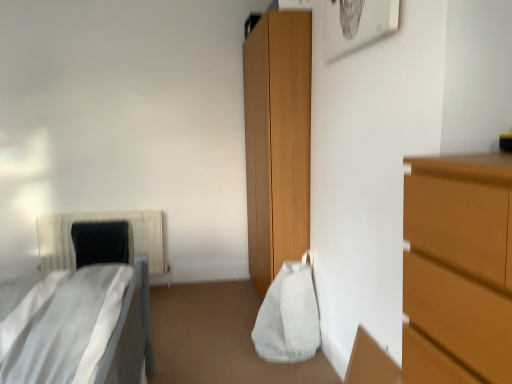
Question: Considering the relative positions of white fabric bag at center and white textured radiator at left in the image provided, is white fabric bag at center to the left of white textured radiator at left from the viewer's perspective?

Choices:
 (A) no
 (B) yes

Answer: (A)

Question: From the image's perspective, is white fabric bag at center above white textured radiator at left?

Choices:
 (A) yes
 (B) no

Answer: (B)

Question: Is white textured radiator at left surrounded by white fabric bag at center?

Choices:
 (A) no
 (B) yes

Answer: (A)

Question: Can you confirm if white fabric bag at center is smaller than white textured radiator at left?

Choices:
 (A) yes
 (B) no

Answer: (A)

Question: Can you confirm if white fabric bag at center is positioned to the right of white textured radiator at left?

Choices:
 (A) yes
 (B) no

Answer: (A)

Question: Can we say white fabric bag at center lies outside white textured radiator at left?

Choices:
 (A) no
 (B) yes

Answer: (B)

Question: From the image's perspective, is black fabric pillow at left above white textured radiator at left?

Choices:
 (A) no
 (B) yes

Answer: (B)

Question: From the image's perspective, is black fabric pillow at left below white textured radiator at left?

Choices:
 (A) no
 (B) yes

Answer: (A)

Question: Is black fabric pillow at left next to white textured radiator at left and touching it?

Choices:
 (A) yes
 (B) no

Answer: (B)

Question: Is black fabric pillow at left at the right side of white textured radiator at left?

Choices:
 (A) no
 (B) yes

Answer: (B)

Question: From a real-world perspective, is black fabric pillow at left located higher than white textured radiator at left?

Choices:
 (A) no
 (B) yes

Answer: (B)

Question: Is black fabric pillow at left surrounding white textured radiator at left?

Choices:
 (A) no
 (B) yes

Answer: (A)

Question: From a real-world perspective, is white fabric bed at left physically above black fabric pillow at left?

Choices:
 (A) yes
 (B) no

Answer: (A)